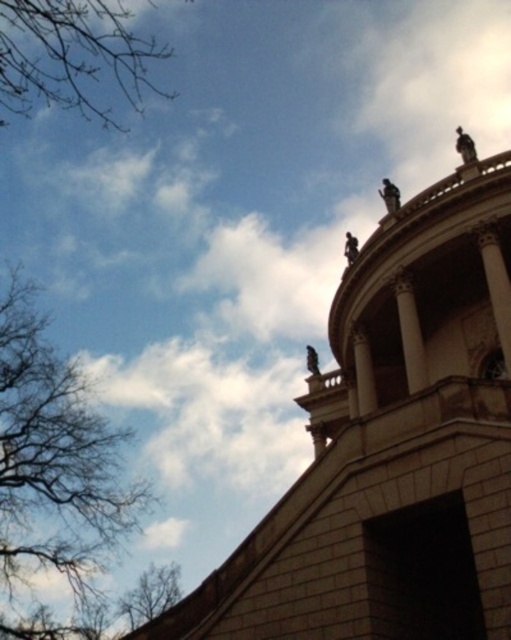
Who is shorter, brown leafless tree at left or bare branches at upper left?

With less height is bare branches at upper left.

What do you see at coordinates (53, 470) in the screenshot? I see `brown leafless tree at left` at bounding box center [53, 470].

Between point (103, 513) and point (161, 92), which one is positioned in front?

Point (103, 513) is more forward.

You are a GUI agent. You are given a task and a screenshot of the screen. Output one action in this format:
    pyautogui.click(x=<x>, y=<y>)
    Task: Click on the brown leafless tree at left
    The height and width of the screenshot is (640, 511).
    Given the screenshot: What is the action you would take?
    pyautogui.click(x=53, y=470)

Is bare branches at upper left closer to the viewer compared to bare branches at lower left?

Yes.

Where is `bare branches at upper left`? bare branches at upper left is located at coordinates (73, 58).

Between point (67, 365) and point (146, 588), which one is positioned behind?

Positioned behind is point (146, 588).

Is point (68, 477) positioned after point (171, 604)?

No.

You are a GUI agent. You are given a task and a screenshot of the screen. Output one action in this format:
    pyautogui.click(x=<x>, y=<y>)
    Task: Click on the brown leafless tree at left
    
    Given the screenshot: What is the action you would take?
    point(53,470)